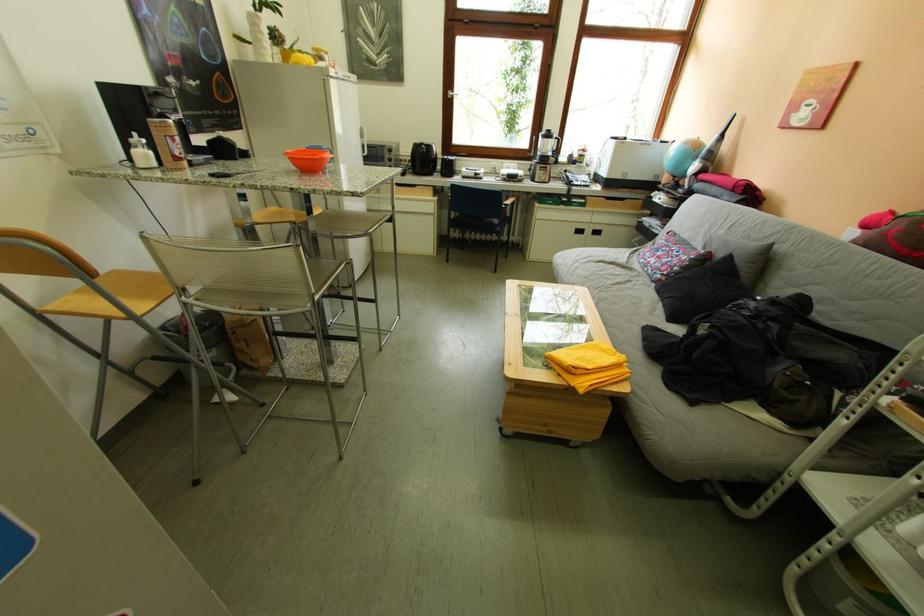
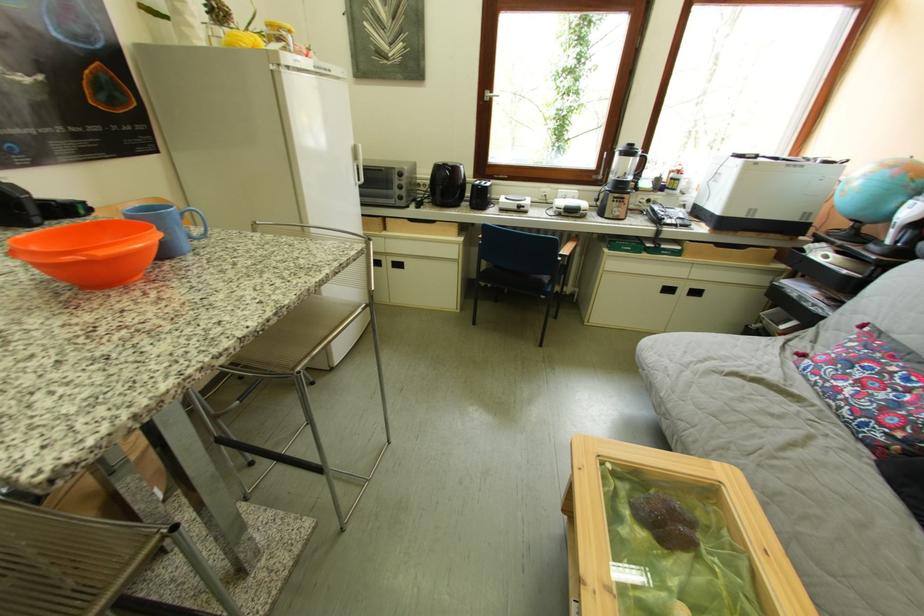
The point at (596, 204) is marked in the first image. Where is the corresponding point in the second image?

(690, 251)